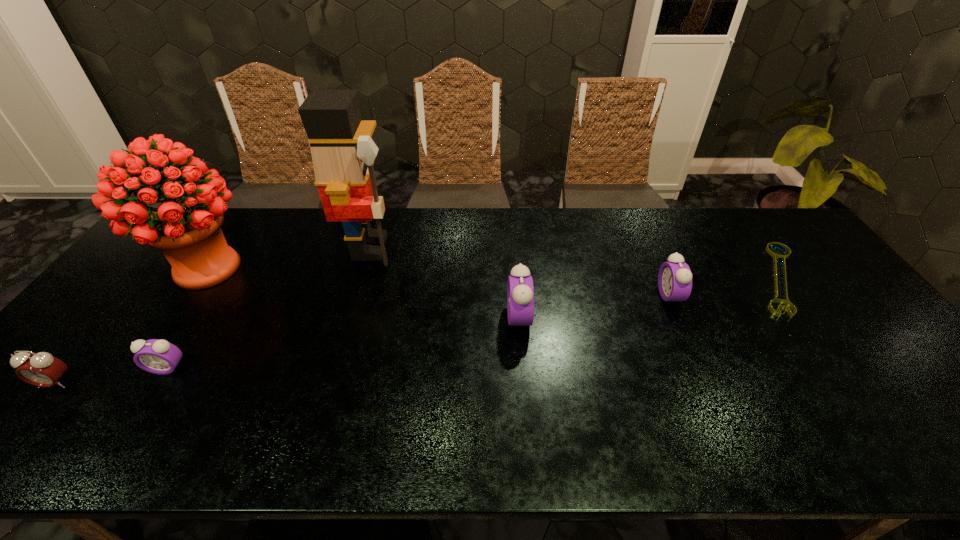
Where is `the third farthest alarm clock`? Image resolution: width=960 pixels, height=540 pixels. the third farthest alarm clock is located at coordinates (156, 356).

Find the location of a particular element. The height and width of the screenshot is (540, 960). the shortest alarm clock is located at coordinates (156, 356).

What are the coordinates of `the third object from right to left` in the screenshot? It's located at (520, 291).

Find the location of `the tallest alarm clock`. the tallest alarm clock is located at coordinates (520, 291).

Identify the location of the rightmost alarm clock. The image size is (960, 540). (675, 278).

You are a GUI agent. You are given a task and a screenshot of the screen. Output one action in this format:
    pyautogui.click(x=<x>, y=<y>)
    Task: Click on the nutcracker
    Image resolution: width=960 pixels, height=540 pixels.
    Given the screenshot: What is the action you would take?
    point(343,153)

Identify the location of the shortest object. (781, 256).

Find the location of a particular element. The width and height of the screenshot is (960, 540). wrench is located at coordinates (781, 256).

At what (x,y) coordinates should I click in order to perform the action: click on bouquet. Please return your answer as a coordinate pair (x, y). The height and width of the screenshot is (540, 960). Looking at the image, I should click on (188, 232).

The height and width of the screenshot is (540, 960). In order to click on the nearest alarm clock in this screenshot , I will do `click(41, 369)`.